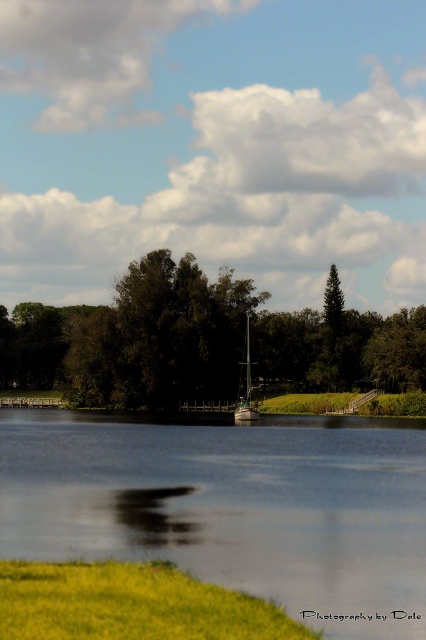
Is smooth water at center wider than metallic silver sailboat at center?

Indeed, smooth water at center has a greater width compared to metallic silver sailboat at center.

Is point (233, 541) in front of point (252, 410)?

Yes, point (233, 541) is closer to viewer.

I want to click on smooth water at center, so click(x=233, y=508).

Can you confirm if green leafy tree at center is taller than metallic silver sailboat at center?

Indeed, green leafy tree at center has a greater height compared to metallic silver sailboat at center.

This screenshot has height=640, width=426. Find the location of `green leafy tree at center`. green leafy tree at center is located at coordinates (201, 340).

I want to click on green leafy tree at center, so click(201, 340).

Does smooth water at center appear over green leafy tree at center?

No, smooth water at center is not above green leafy tree at center.

Is smooth water at center bigger than green leafy tree at center?

Incorrect, smooth water at center is not larger than green leafy tree at center.

Between point (345, 580) and point (183, 358), which one is positioned behind?

Point (183, 358)

Locate an element on the screen. The width and height of the screenshot is (426, 640). smooth water at center is located at coordinates (233, 508).